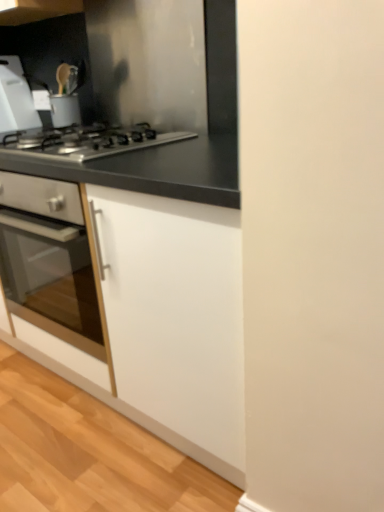
Question: Is black matte countertop at upper left taller than white matte cabinet at center?

Choices:
 (A) yes
 (B) no

Answer: (B)

Question: Does black matte countertop at upper left have a lesser width compared to white matte cabinet at center?

Choices:
 (A) yes
 (B) no

Answer: (A)

Question: Would you say white matte cabinet at center is part of black matte countertop at upper left's contents?

Choices:
 (A) yes
 (B) no

Answer: (B)

Question: Is black matte countertop at upper left directly adjacent to white matte cabinet at center?

Choices:
 (A) yes
 (B) no

Answer: (B)

Question: Would you say black matte countertop at upper left is a long distance from white matte cabinet at center?

Choices:
 (A) yes
 (B) no

Answer: (B)

Question: Is black matte countertop at upper left wider than white matte cabinet at center?

Choices:
 (A) no
 (B) yes

Answer: (A)

Question: Does black matte countertop at upper left have a lesser height compared to white plastic cutting board at upper left?

Choices:
 (A) yes
 (B) no

Answer: (B)

Question: Is black matte countertop at upper left closer to camera compared to white plastic cutting board at upper left?

Choices:
 (A) yes
 (B) no

Answer: (A)

Question: Is black matte countertop at upper left touching white plastic cutting board at upper left?

Choices:
 (A) yes
 (B) no

Answer: (B)

Question: Can you confirm if black matte countertop at upper left is thinner than white plastic cutting board at upper left?

Choices:
 (A) yes
 (B) no

Answer: (A)

Question: Is black matte countertop at upper left smaller than white plastic cutting board at upper left?

Choices:
 (A) yes
 (B) no

Answer: (B)

Question: From the image's perspective, is black matte countertop at upper left over white plastic cutting board at upper left?

Choices:
 (A) yes
 (B) no

Answer: (A)

Question: Does black matte countertop at upper left have a larger size compared to stainless steel gas stove at center?

Choices:
 (A) no
 (B) yes

Answer: (A)